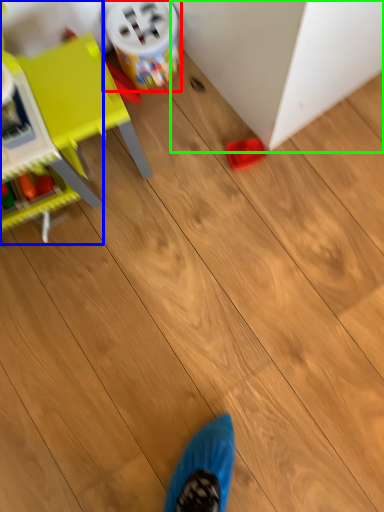
Question: Considering the real-world distances, which object is closest to toy (highlighted by a red box)? toy (highlighted by a blue box) or furniture (highlighted by a green box).

Choices:
 (A) toy
 (B) furniture

Answer: (B)